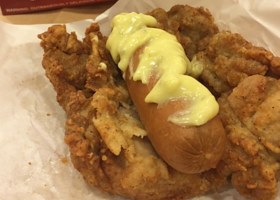
This screenshot has width=280, height=200. I want to click on box, so click(17, 5).